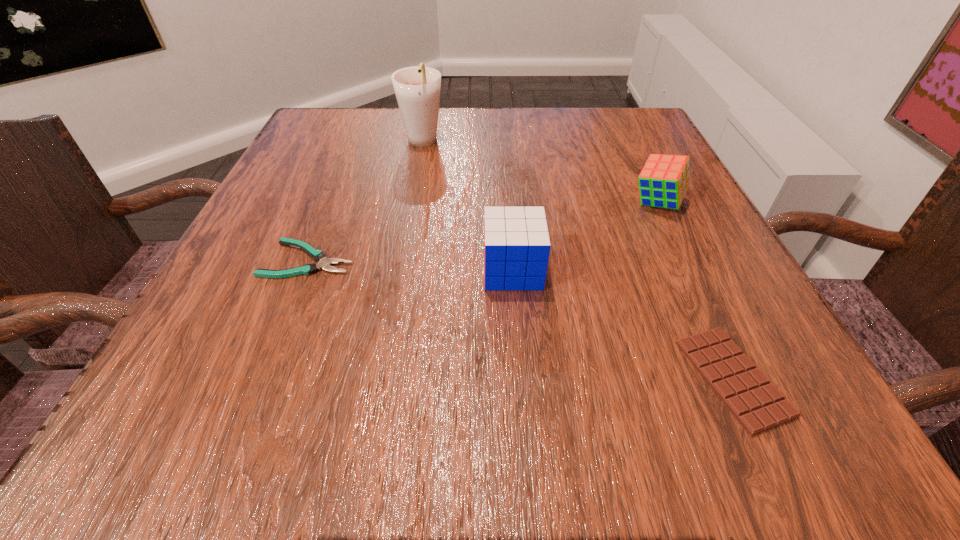
At what (x,y) coordinates should I click in order to perform the action: click on vacant space positioned on the back of the third object from right to left. Please return your answer as a coordinate pair (x, y). The image size is (960, 540). Looking at the image, I should click on (510, 231).

Identify the location of free space located on the right of the pliers. The image size is (960, 540). [x=489, y=259].

At what (x,y) coordinates should I click in order to perform the action: click on free space located on the left of the nearest object. Please return your answer as a coordinate pair (x, y). Looking at the image, I should click on (582, 378).

Where is `object at the far edge`? Image resolution: width=960 pixels, height=540 pixels. object at the far edge is located at coordinates (417, 89).

This screenshot has height=540, width=960. In order to click on object that is at the near edge in this screenshot , I will do `click(757, 404)`.

Find the location of a particular element. This screenshot has width=960, height=540. object that is at the left edge is located at coordinates (318, 255).

The height and width of the screenshot is (540, 960). I want to click on cube that is positioned at the right edge, so click(664, 180).

You are a GUI agent. You are given a task and a screenshot of the screen. Output one action in this format:
    pyautogui.click(x=<x>, y=<y>)
    Task: Click on the candy bar present at the right edge
    This screenshot has height=540, width=960.
    Given the screenshot: What is the action you would take?
    pyautogui.click(x=757, y=404)

Where is `object located at the near right corner`? The width and height of the screenshot is (960, 540). object located at the near right corner is located at coordinates (757, 404).

The image size is (960, 540). In the image, there is a desktop. Identify the location of free space at the far edge. (478, 134).